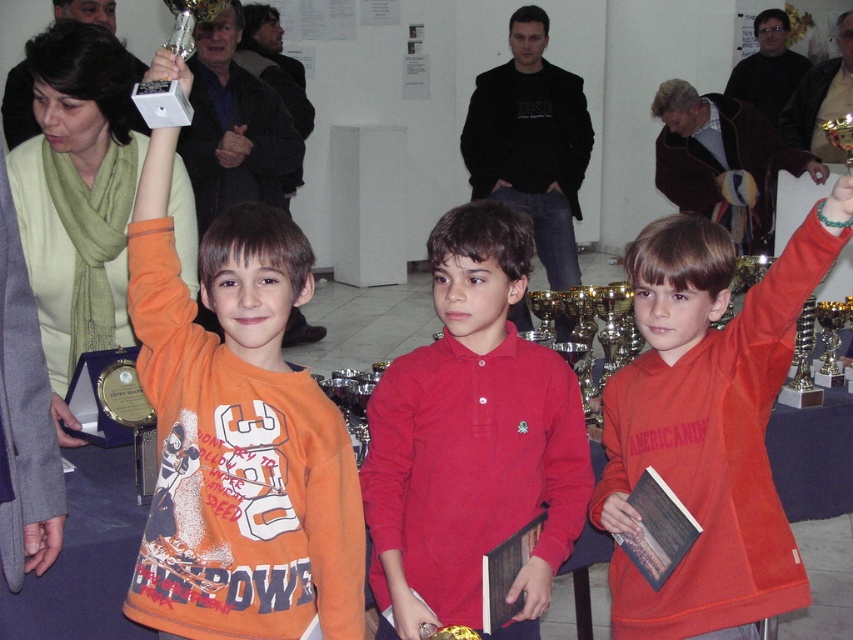
Who is positioned more to the right, metallic trophy at upper left or green beaded bracelet at upper center?

From the viewer's perspective, green beaded bracelet at upper center appears more on the right side.

Does point (160, 58) come closer to viewer compared to point (822, 209)?

No, (160, 58) is further to viewer.

Identify the location of metallic trophy at upper left. (165, 77).

Locate an element on the screen. This screenshot has width=853, height=640. metallic trophy at upper left is located at coordinates (165, 77).

Is orange fleece sweatshirt at upper right taller than green beaded bracelet at upper center?

Correct, orange fleece sweatshirt at upper right is much taller as green beaded bracelet at upper center.

Which of these two, orange fleece sweatshirt at upper right or green beaded bracelet at upper center, stands taller?

orange fleece sweatshirt at upper right is taller.

Does point (695, 458) come in front of point (839, 193)?

No, (695, 458) is further to viewer.

You are a GUI agent. You are given a task and a screenshot of the screen. Output one action in this format:
    pyautogui.click(x=<x>, y=<y>)
    Task: Click on the orange fleece sweatshirt at upper right
    The image size is (853, 640).
    Given the screenshot: What is the action you would take?
    pyautogui.click(x=706, y=426)

Which is behind, point (172, 564) or point (161, 88)?

Positioned behind is point (161, 88).

Which of these two, orange cotton shirt at left or metallic trophy at upper left, stands taller?

With more height is orange cotton shirt at left.

The height and width of the screenshot is (640, 853). Describe the element at coordinates (236, 435) in the screenshot. I see `orange cotton shirt at left` at that location.

Identify the location of orange cotton shirt at left. (236, 435).